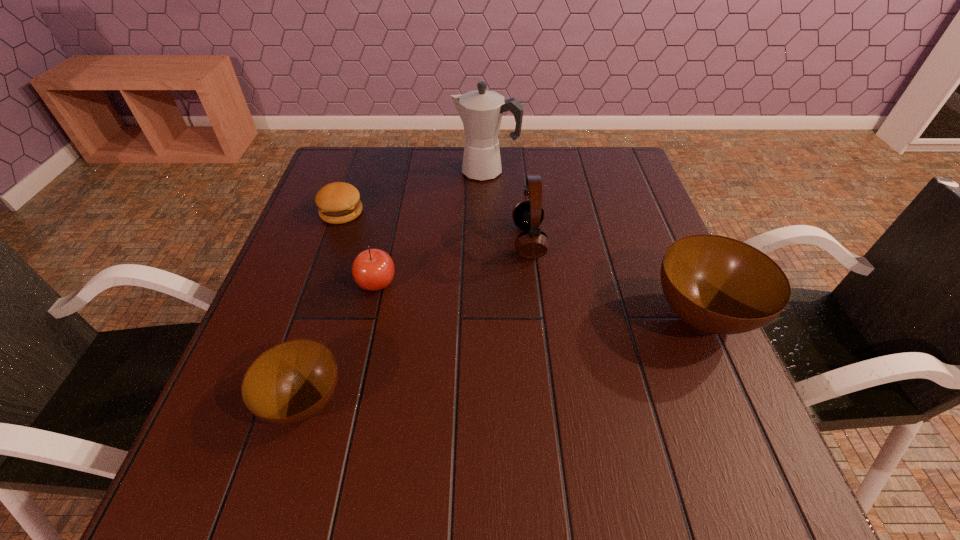
At what (x,y) coordinates should I click in order to perform the action: click on vacant region located on the left of the rightmost object. Please return your answer as a coordinate pair (x, y). Image resolution: width=960 pixels, height=540 pixels. Looking at the image, I should click on (590, 315).

Where is `blank space located on the left of the tallest object`? blank space located on the left of the tallest object is located at coordinates (385, 171).

You are a GUI agent. You are given a task and a screenshot of the screen. Output one action in this format:
    pyautogui.click(x=<x>, y=<y>)
    Task: Click on the vacant region located 0.130m on the ear pads of the headset
    
    Given the screenshot: What is the action you would take?
    pyautogui.click(x=460, y=241)

The image size is (960, 540). What are the coordinates of `free spot located 0.110m on the ear pads of the headset` in the screenshot? It's located at (468, 241).

Image resolution: width=960 pixels, height=540 pixels. What are the coordinates of `vacant space located 0.260m on the ear pads of the headset` in the screenshot? It's located at (407, 241).

Where is `vacant area situated 0.300m on the front of the apple`? vacant area situated 0.300m on the front of the apple is located at coordinates (344, 431).

What are the coordinates of `free region located on the right of the hamburger` in the screenshot? It's located at (449, 213).

Find the location of a particular element. object that is at the far edge is located at coordinates (481, 111).

This screenshot has height=540, width=960. In order to click on object present at the near edge in this screenshot , I will do `click(291, 382)`.

The width and height of the screenshot is (960, 540). Find the location of `bowl that is at the left edge`. bowl that is at the left edge is located at coordinates (291, 382).